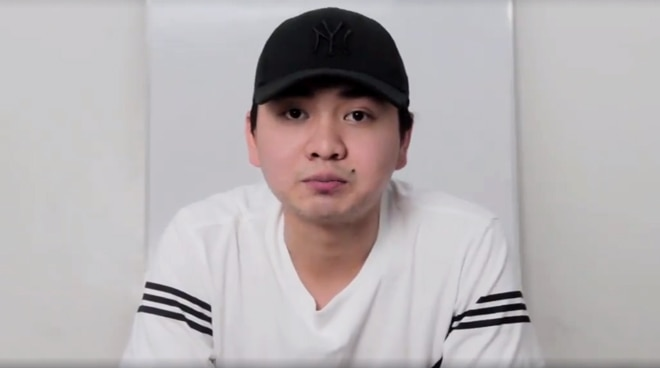
Image resolution: width=660 pixels, height=368 pixels. In order to click on wall in this screenshot , I will do `click(176, 113)`.